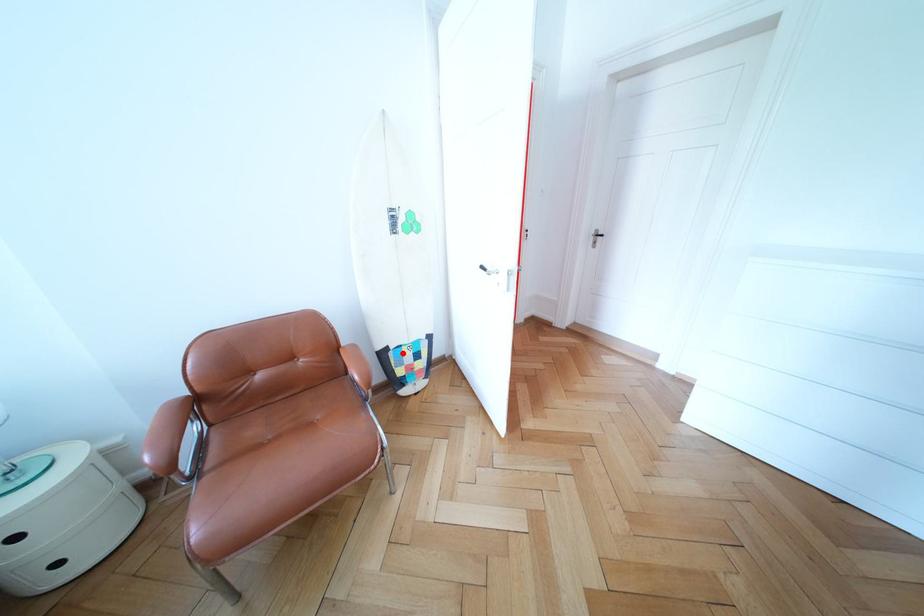
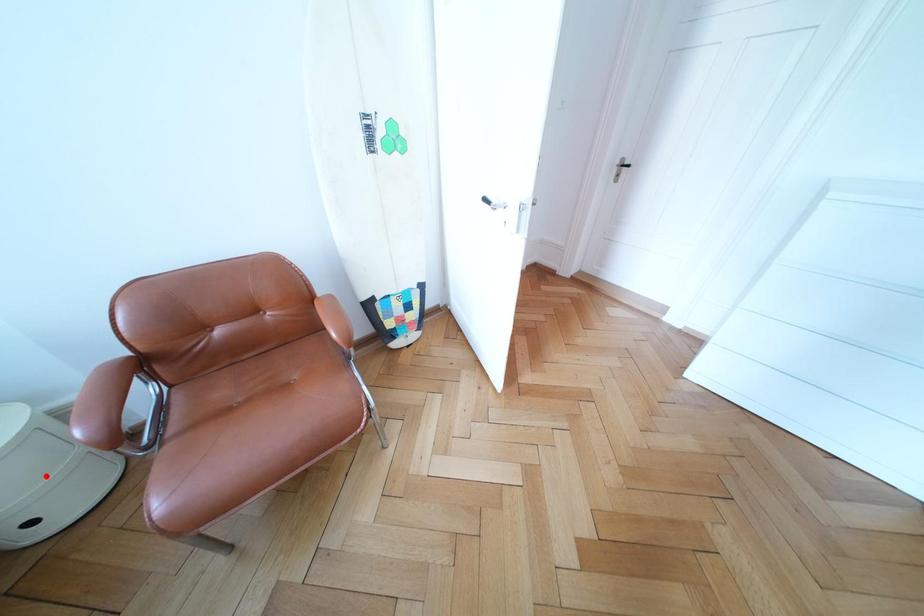
I am providing you with two images of the same scene from different viewpoints. A red point is marked on the first image and another point is marked on the second image. Is the marked point in image1 the same physical position as the marked point in image2?

No